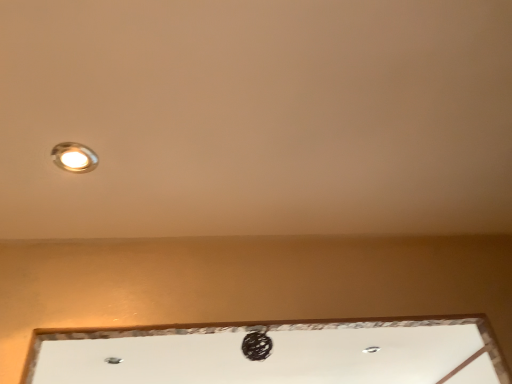
The height and width of the screenshot is (384, 512). What do you see at coordinates (74, 157) in the screenshot?
I see `matte silver lamp at upper left` at bounding box center [74, 157].

Based on the photo, measure the distance between matte silver lamp at upper left and camera.

They are 93.75 centimeters apart.

Locate an element on the screen. Image resolution: width=512 pixels, height=384 pixels. matte silver lamp at upper left is located at coordinates 74,157.

The width and height of the screenshot is (512, 384). What do you see at coordinates (273, 352) in the screenshot?
I see `white glossy window at center` at bounding box center [273, 352].

Find the location of a particular element. The width and height of the screenshot is (512, 384). white glossy window at center is located at coordinates (273, 352).

I want to click on matte silver lamp at upper left, so click(x=74, y=157).

Which is more to the left, matte silver lamp at upper left or white glossy window at center?

From the viewer's perspective, matte silver lamp at upper left appears more on the left side.

Between matte silver lamp at upper left and white glossy window at center, which one is positioned behind?

Positioned behind is white glossy window at center.

Considering the positions of points (72, 163) and (435, 317), is point (72, 163) closer to camera compared to point (435, 317)?

Yes, it is in front of point (435, 317).

From the image's perspective, is matte silver lamp at upper left under white glossy window at center?

Actually, matte silver lamp at upper left appears above white glossy window at center in the image.

From a real-world perspective, is matte silver lamp at upper left positioned above or below white glossy window at center?

matte silver lamp at upper left is below white glossy window at center.

Considering the sizes of objects matte silver lamp at upper left and white glossy window at center in the image provided, who is wider, matte silver lamp at upper left or white glossy window at center?

With larger width is white glossy window at center.

Is matte silver lamp at upper left taller or shorter than white glossy window at center?

Clearly, matte silver lamp at upper left is shorter compared to white glossy window at center.

Considering the sizes of matte silver lamp at upper left and white glossy window at center in the image, is matte silver lamp at upper left bigger or smaller than white glossy window at center?

In the image, matte silver lamp at upper left appears to be smaller than white glossy window at center.

Would you say matte silver lamp at upper left contains white glossy window at center?

No, white glossy window at center is not inside matte silver lamp at upper left.

Are matte silver lamp at upper left and white glossy window at center far apart?

Yes.

In the scene shown: Is matte silver lamp at upper left positioned with its back to white glossy window at center?

Yes, matte silver lamp at upper left's orientation is away from white glossy window at center.

Find the location of a particular element. The image size is (512, 384). lamp beneath the white glossy window at center (from a real-world perspective) is located at coordinates (74, 157).

Which is more to the right, white glossy window at center or matte silver lamp at upper left?

white glossy window at center is more to the right.

Is white glossy window at center closer to the viewer compared to matte silver lamp at upper left?

No, it is not.

Does point (95, 337) come in front of point (83, 170)?

No, (95, 337) is further to viewer.

From the image's perspective, is white glossy window at center on matte silver lamp at upper left?

No, from the image's perspective, white glossy window at center is not above matte silver lamp at upper left.

From a real-world perspective, between white glossy window at center and matte silver lamp at upper left, who is vertically higher?

white glossy window at center.

Considering the sizes of objects white glossy window at center and matte silver lamp at upper left in the image provided, who is thinner, white glossy window at center or matte silver lamp at upper left?

matte silver lamp at upper left is thinner.

In the scene shown: Between white glossy window at center and matte silver lamp at upper left, which one has less height?

With less height is matte silver lamp at upper left.

Can you confirm if white glossy window at center is bigger than matte silver lamp at upper left?

Yes.

Would you say white glossy window at center is inside or outside matte silver lamp at upper left?

white glossy window at center is located beyond the bounds of matte silver lamp at upper left.

Is white glossy window at center beside matte silver lamp at upper left?

They are not placed beside each other.

Is white glossy window at center aimed at matte silver lamp at upper left?

Yes, white glossy window at center is facing matte silver lamp at upper left.

The width and height of the screenshot is (512, 384). What are the coordinates of `window below the matte silver lamp at upper left (from the image's perspective)` in the screenshot? It's located at pyautogui.click(x=273, y=352).

I want to click on window below the matte silver lamp at upper left (from the image's perspective), so click(x=273, y=352).

What are the coordinates of `lamp located in front of the white glossy window at center` in the screenshot? It's located at coord(74,157).